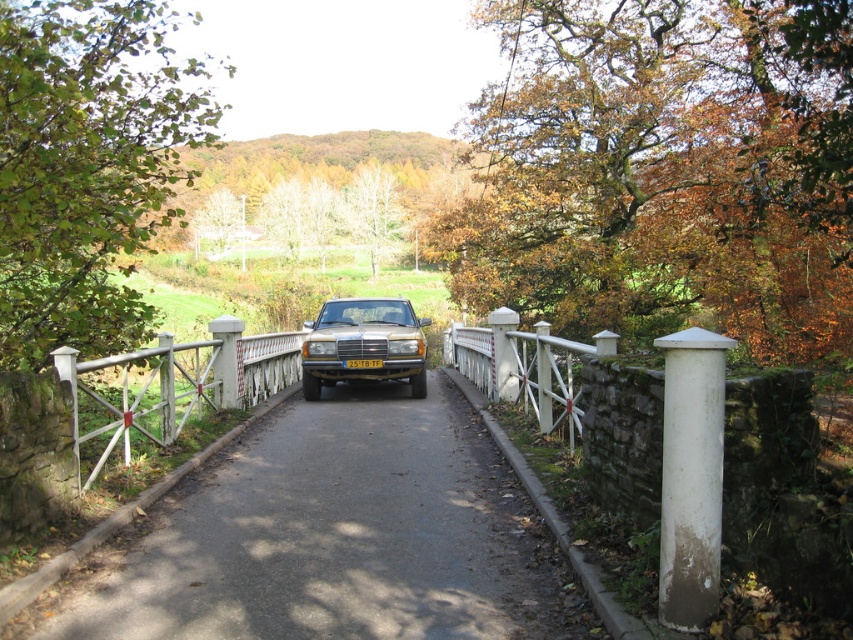
You are a cyclist planning to cross the small stone bridge. The black asphalt road at center is the only path available. If your bicycle requires a minimum of 2 meters of space to safely pass, can you safely ride across the bridge?

The black asphalt road at center is 5.27 meters wide, which is more than the required 2 meters of space needed for the bicycle to safely pass. Therefore, you can safely ride across the bridge.

You are a delivery drone that needs to fly over the black asphalt road at center and the gold metallic car at center. Which object should you fly over first to avoid obstacles?

The black asphalt road at center has a lesser height compared to the gold metallic car at center, so you should fly over the gold metallic car at center first to avoid obstacles.